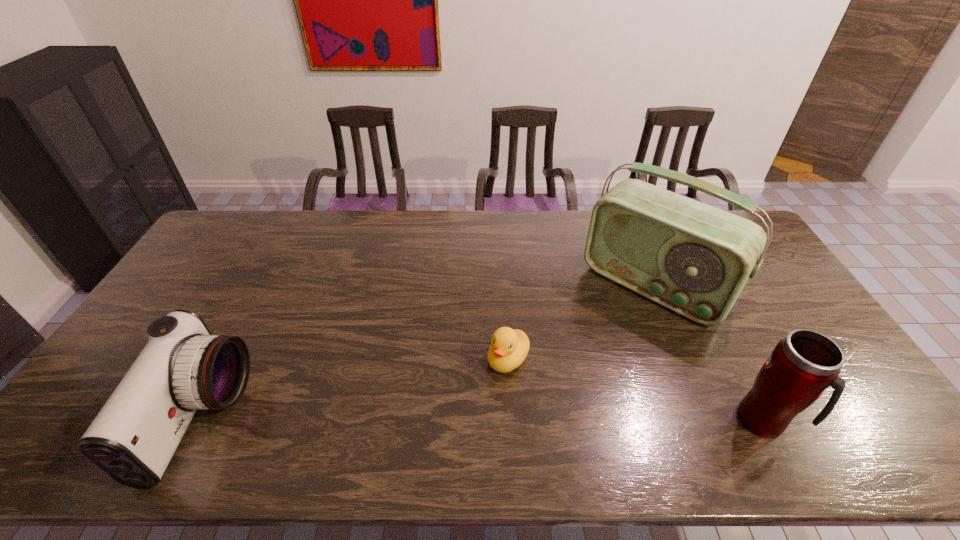
This screenshot has width=960, height=540. Find the location of `vacant space on the desktop that is between the third tallest object and the second tallest object and is positioned on the front panel of the radio receiver`. vacant space on the desktop that is between the third tallest object and the second tallest object and is positioned on the front panel of the radio receiver is located at coordinates (542, 420).

What are the coordinates of `vacant spot on the desktop that is between the camcorder and the thermos bottle and is positioned on the face of the duckling` in the screenshot? It's located at (450, 420).